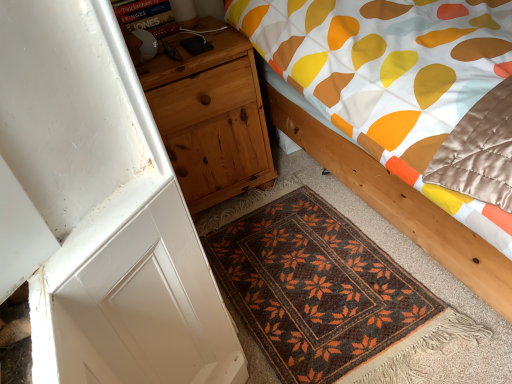
Question: Should I look upward or downward to see natural wood nightstand at left?

Choices:
 (A) down
 (B) up

Answer: (B)

Question: Considering the relative sizes of wooden bed at center and natural wood nightstand at left in the image provided, is wooden bed at center thinner than natural wood nightstand at left?

Choices:
 (A) yes
 (B) no

Answer: (B)

Question: Is wooden bed at center positioned beyond the bounds of natural wood nightstand at left?

Choices:
 (A) yes
 (B) no

Answer: (A)

Question: From the image's perspective, is wooden bed at center on natural wood nightstand at left?

Choices:
 (A) yes
 (B) no

Answer: (A)

Question: Does wooden bed at center have a larger size compared to natural wood nightstand at left?

Choices:
 (A) no
 (B) yes

Answer: (B)

Question: Does wooden bed at center lie in front of natural wood nightstand at left?

Choices:
 (A) no
 (B) yes

Answer: (B)

Question: From the image's perspective, is wooden bed at center located beneath natural wood nightstand at left?

Choices:
 (A) yes
 (B) no

Answer: (B)

Question: Would you say brown woven mat at lower center is part of wooden bed at center's contents?

Choices:
 (A) yes
 (B) no

Answer: (B)

Question: Considering the relative positions of wooden bed at center and brown woven mat at lower center in the image provided, is wooden bed at center to the left of brown woven mat at lower center from the viewer's perspective?

Choices:
 (A) no
 (B) yes

Answer: (A)

Question: From the image's perspective, is wooden bed at center over brown woven mat at lower center?

Choices:
 (A) yes
 (B) no

Answer: (A)

Question: Considering the relative positions of wooden bed at center and brown woven mat at lower center in the image provided, is wooden bed at center to the right of brown woven mat at lower center from the viewer's perspective?

Choices:
 (A) no
 (B) yes

Answer: (B)

Question: Is there a large distance between wooden bed at center and brown woven mat at lower center?

Choices:
 (A) yes
 (B) no

Answer: (B)

Question: Is wooden bed at center bigger than brown woven mat at lower center?

Choices:
 (A) no
 (B) yes

Answer: (B)

Question: Could you tell me if natural wood nightstand at left is facing wooden bed at center?

Choices:
 (A) no
 (B) yes

Answer: (A)